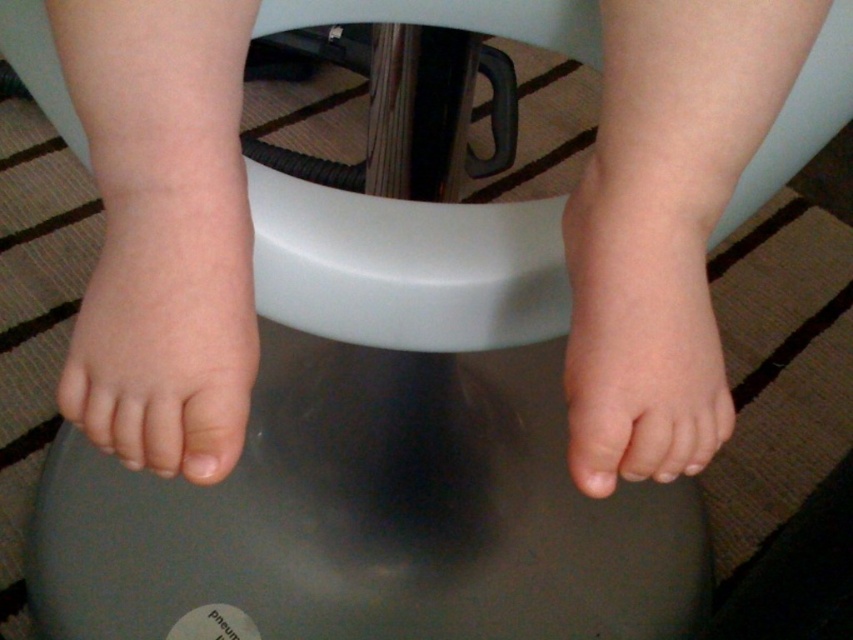
Looking at this image, who is more distant from viewer, [247,224] or [614,477]?

The point [614,477] is more distant.

Between pink smooth foot at lower left and pink matte toe at center, which one has less height?

With less height is pink matte toe at center.

This screenshot has height=640, width=853. Describe the element at coordinates (164, 339) in the screenshot. I see `pink smooth foot at lower left` at that location.

You are a GUI agent. You are given a task and a screenshot of the screen. Output one action in this format:
    pyautogui.click(x=<x>, y=<y>)
    Task: Click on the pink smooth foot at lower left
    Image resolution: width=853 pixels, height=640 pixels.
    Given the screenshot: What is the action you would take?
    pyautogui.click(x=164, y=339)

Who is more forward, (590, 454) or (117, 308)?

Point (590, 454) is in front.

Does skin smooth feet at center appear on the left side of pink smooth foot at lower left?

In fact, skin smooth feet at center is to the right of pink smooth foot at lower left.

Who is more distant from viewer, (165, 172) or (223, 452)?

The point (223, 452) is behind.

Identify the location of skin smooth feet at center. (161, 227).

Can you confirm if pale pink flesh at center is thinner than pink matte toe at center?

Indeed, pale pink flesh at center has a lesser width compared to pink matte toe at center.

Consider the image. Can you confirm if pale pink flesh at center is positioned below pink matte toe at center?

No, pale pink flesh at center is not below pink matte toe at center.

Find the location of a particular element. This screenshot has width=853, height=640. pale pink flesh at center is located at coordinates (201, 465).